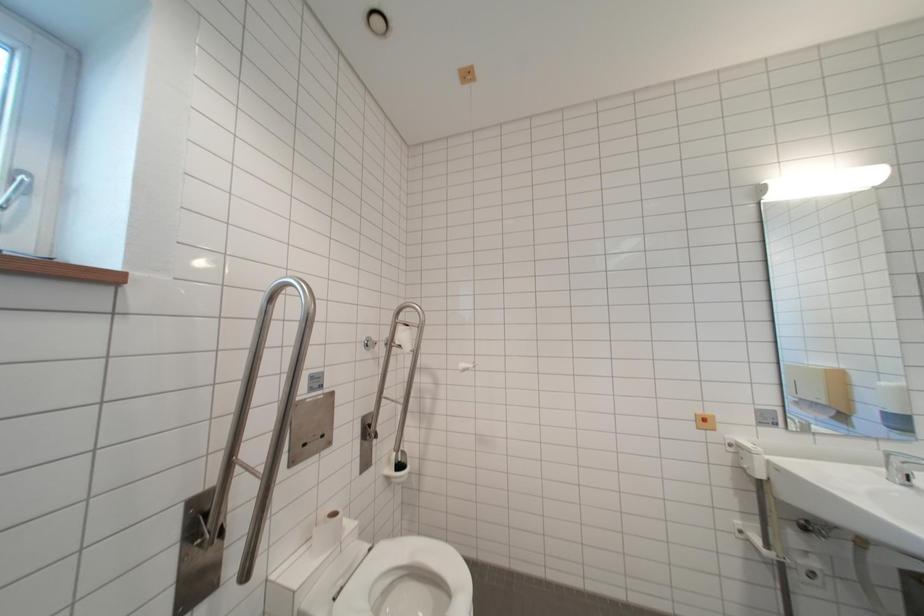
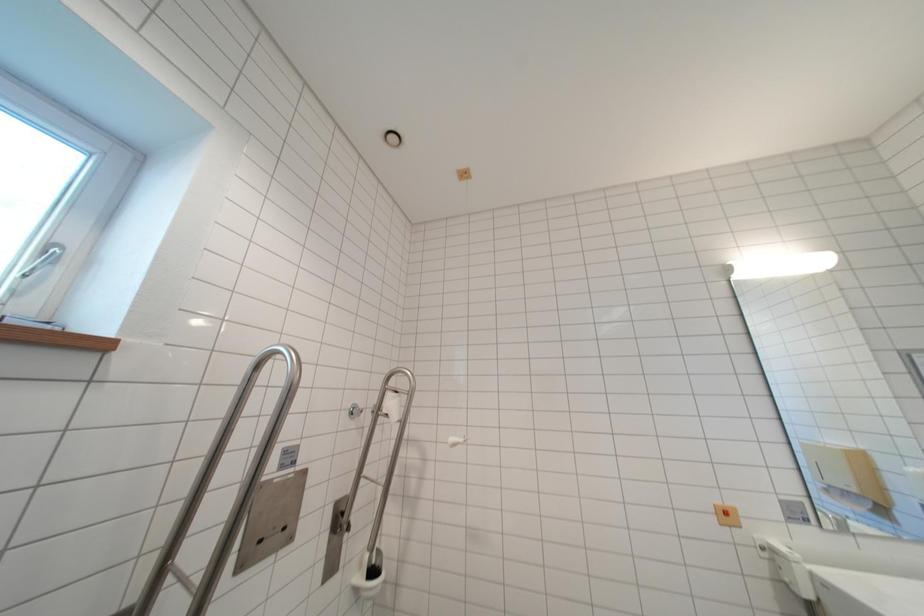
Which direction would the cameraman need to move to produce the second image?

The cameraman moved toward right, backward.